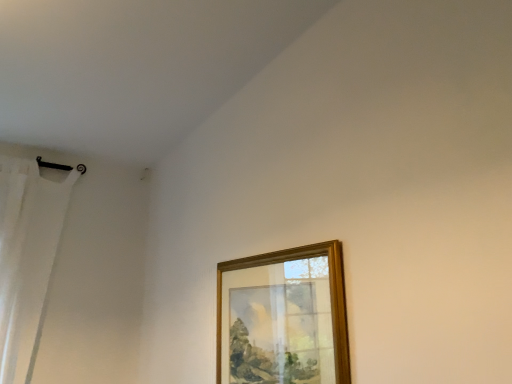
Question: Is wooden picture frame at upper center wider or thinner than white sheer curtain at left?

Choices:
 (A) wide
 (B) thin

Answer: (B)

Question: In terms of size, does wooden picture frame at upper center appear bigger or smaller than white sheer curtain at left?

Choices:
 (A) small
 (B) big

Answer: (A)

Question: From a real-world perspective, is wooden picture frame at upper center positioned above or below white sheer curtain at left?

Choices:
 (A) above
 (B) below

Answer: (B)

Question: From a real-world perspective, relative to wooden picture frame at upper center, is white sheer curtain at left vertically above or below?

Choices:
 (A) above
 (B) below

Answer: (A)

Question: Relative to wooden picture frame at upper center, is white sheer curtain at left in front or behind?

Choices:
 (A) front
 (B) behind

Answer: (B)

Question: Is point (25, 324) positioned closer to the camera than point (267, 274)?

Choices:
 (A) closer
 (B) farther

Answer: (B)

Question: Considering the positions of white sheer curtain at left and wooden picture frame at upper center in the image, is white sheer curtain at left taller or shorter than wooden picture frame at upper center?

Choices:
 (A) tall
 (B) short

Answer: (A)